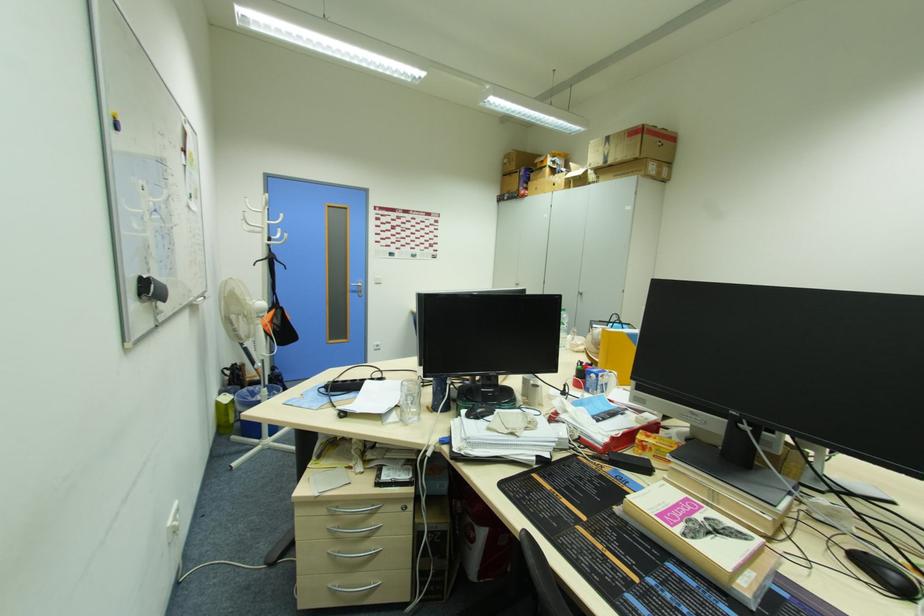
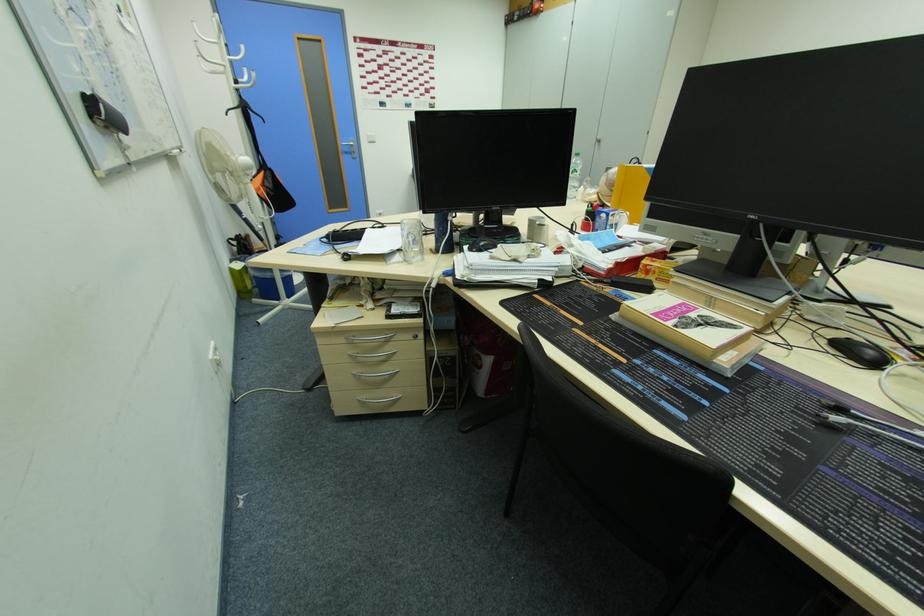
Which direction would the cameraman need to move to produce the second image?

The cameraman walked toward right, forward.